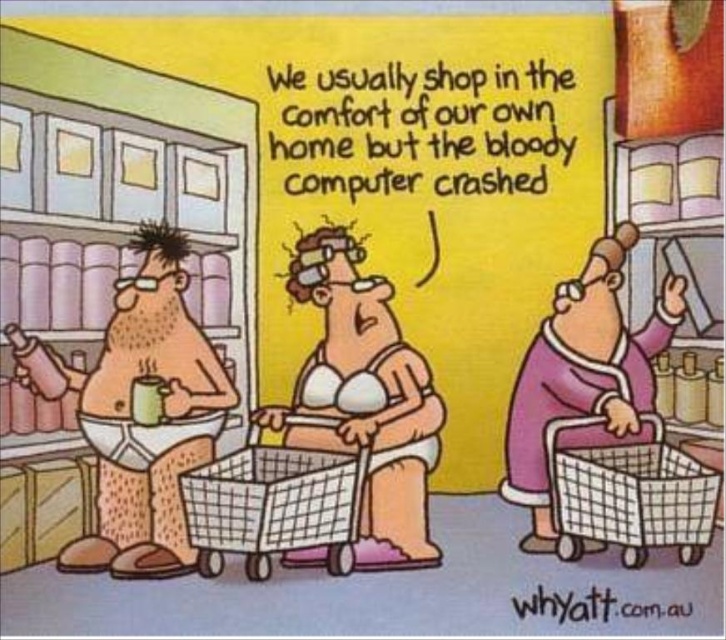
You are a customer in the grocery store and want to place a bag of chips into the purple fabric shopping basket at lower right. However, you notice the plastic mesh shopping cart at lower right is in the way. Can you easily access the basket without moving the cart?

The purple fabric shopping basket at lower right is positioned over the plastic mesh shopping cart at lower right, so you cannot easily access the basket without moving the cart.

You are a delivery robot with a width of 3 inches. You need to move through the space between the white matte shopping cart at center and the white mesh shopping cart at center. Can you fit through the gap between them?

The gap between the white matte shopping cart at center and the white mesh shopping cart at center is 3.35 inches, so the robot can fit through the gap since it is wider than the robot.